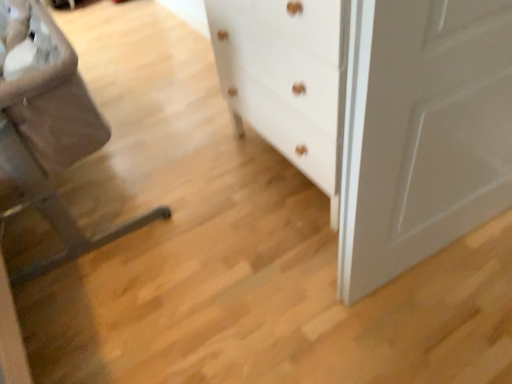
Find the location of a particular element. white matte chest of drawers at center is located at coordinates (379, 115).

What do you see at coordinates (379, 115) in the screenshot?
I see `white matte chest of drawers at center` at bounding box center [379, 115].

Measure the distance between point (x=228, y=3) and camera.

Point (x=228, y=3) and camera are 1.43 meters apart from each other.

What is the approximate height of brown fabric rocking chair at left?

brown fabric rocking chair at left is 78.59 centimeters in height.

Image resolution: width=512 pixels, height=384 pixels. Find the location of `brown fabric rocking chair at left`. brown fabric rocking chair at left is located at coordinates (50, 134).

What do you see at coordinates (50, 134) in the screenshot? This screenshot has width=512, height=384. I see `brown fabric rocking chair at left` at bounding box center [50, 134].

In order to click on white matte chest of drawers at center in this screenshot , I will do `click(379, 115)`.

Looking at this image, can you confirm if brown fabric rocking chair at left is positioned to the right of white matte chest of drawers at center?

In fact, brown fabric rocking chair at left is to the left of white matte chest of drawers at center.

Which object is closer to the camera taking this photo, brown fabric rocking chair at left or white matte chest of drawers at center?

brown fabric rocking chair at left is more forward.

Which is closer, [70,251] or [269,89]?

Point [70,251].

From the image's perspective, between brown fabric rocking chair at left and white matte chest of drawers at center, which one is located above?

white matte chest of drawers at center.

From a real-world perspective, is brown fabric rocking chair at left positioned over white matte chest of drawers at center based on gravity?

Incorrect, from a real-world perspective, brown fabric rocking chair at left is lower than white matte chest of drawers at center.

Which object is thinner, brown fabric rocking chair at left or white matte chest of drawers at center?

white matte chest of drawers at center is thinner.

Can you confirm if brown fabric rocking chair at left is shorter than white matte chest of drawers at center?

Correct, brown fabric rocking chair at left is not as tall as white matte chest of drawers at center.

Does brown fabric rocking chair at left have a larger size compared to white matte chest of drawers at center?

Yes.

Can white matte chest of drawers at center be found inside brown fabric rocking chair at left?

That's incorrect, white matte chest of drawers at center is not inside brown fabric rocking chair at left.

Can you see brown fabric rocking chair at left touching white matte chest of drawers at center?

They are not placed beside each other.

Is brown fabric rocking chair at left facing away from white matte chest of drawers at center?

That's not correct — brown fabric rocking chair at left is not looking away from white matte chest of drawers at center.

Can you tell me how much brown fabric rocking chair at left and white matte chest of drawers at center differ in facing direction?

89.1 degrees.

How far apart are brown fabric rocking chair at left and white matte chest of drawers at center?

brown fabric rocking chair at left and white matte chest of drawers at center are 30.18 inches apart.

Where is `the chest of drawers that is above the brown fabric rocking chair at left (from the image's perspective)`? This screenshot has width=512, height=384. the chest of drawers that is above the brown fabric rocking chair at left (from the image's perspective) is located at coordinates 379,115.

Considering the relative positions of white matte chest of drawers at center and brown fabric rocking chair at left in the image provided, is white matte chest of drawers at center to the left or to the right of brown fabric rocking chair at left?

In the image, white matte chest of drawers at center appears on the right side of brown fabric rocking chair at left.

Is the position of white matte chest of drawers at center less distant than that of brown fabric rocking chair at left?

No, the depth of white matte chest of drawers at center is greater than that of brown fabric rocking chair at left.

Does point (224, 0) appear closer or farther from the camera than point (5, 157)?

Point (224, 0).

From the image's perspective, which one is positioned higher, white matte chest of drawers at center or brown fabric rocking chair at left?

white matte chest of drawers at center is shown above in the image.

From a real-world perspective, does white matte chest of drawers at center sit lower than brown fabric rocking chair at left?

No, from a real-world perspective, white matte chest of drawers at center is not below brown fabric rocking chair at left.

Which of these two, white matte chest of drawers at center or brown fabric rocking chair at left, is thinner?

With smaller width is white matte chest of drawers at center.

Considering the relative sizes of white matte chest of drawers at center and brown fabric rocking chair at left in the image provided, is white matte chest of drawers at center shorter than brown fabric rocking chair at left?

No.

In the scene shown: Is white matte chest of drawers at center bigger than brown fabric rocking chair at left?

Incorrect, white matte chest of drawers at center is not larger than brown fabric rocking chair at left.

Is white matte chest of drawers at center spatially inside brown fabric rocking chair at left, or outside of it?

white matte chest of drawers at center is located beyond the bounds of brown fabric rocking chair at left.

Is white matte chest of drawers at center placed right next to brown fabric rocking chair at left?

white matte chest of drawers at center and brown fabric rocking chair at left are clearly separated.

Is white matte chest of drawers at center oriented towards brown fabric rocking chair at left?

Yes.

What's the angular difference between white matte chest of drawers at center and brown fabric rocking chair at left's facing directions?

The angular difference between white matte chest of drawers at center and brown fabric rocking chair at left is 89.1 degrees.

In order to click on chest of drawers that is on the right side of brown fabric rocking chair at left in this screenshot , I will do `click(379, 115)`.

Where is `the chest of drawers behind the brown fabric rocking chair at left`? the chest of drawers behind the brown fabric rocking chair at left is located at coordinates (379, 115).

Where is `chest of drawers above the brown fabric rocking chair at left (from the image's perspective)`? The width and height of the screenshot is (512, 384). chest of drawers above the brown fabric rocking chair at left (from the image's perspective) is located at coordinates (379, 115).